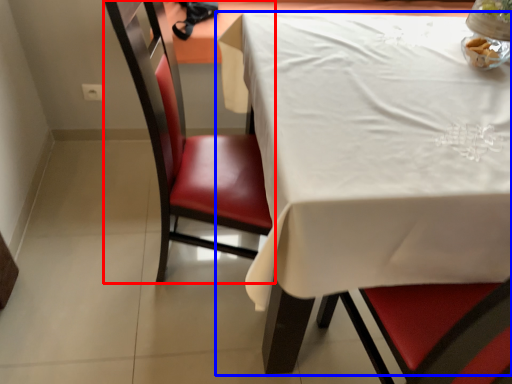
Question: Which of the following is the closest to the observer, chair (highlighted by a red box) or table (highlighted by a blue box)?

Choices:
 (A) chair
 (B) table

Answer: (B)